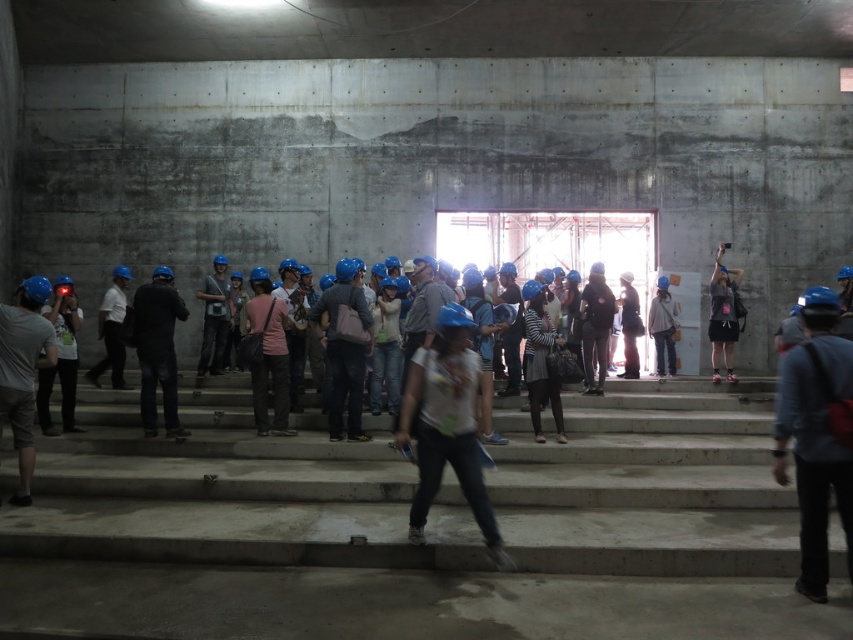
Question: Which of the following is the farthest from the observer?

Choices:
 (A) matte blue helmet at center
 (B) white matte t-shirt at center
 (C) matte black backpack at right
 (D) matte blue helmet at left

Answer: (C)

Question: Which point is farther from the camera taking this photo?

Choices:
 (A) (181, 314)
 (B) (219, 294)
 (C) (416, 428)
 (D) (129, 468)

Answer: (B)

Question: Is matte blue helmet at left behind matte gray vest at center?

Choices:
 (A) yes
 (B) no

Answer: (B)

Question: Is concrete stairs at center bigger than matte gray vest at center?

Choices:
 (A) no
 (B) yes

Answer: (A)

Question: Does dark blue jeans at center come behind matte blue helmet at center?

Choices:
 (A) yes
 (B) no

Answer: (A)

Question: Which of the following is the farthest from the observer?

Choices:
 (A) matte black backpack at right
 (B) white matte helmet at center
 (C) matte blue helmet at left
 (D) pink fabric bag at center

Answer: (A)